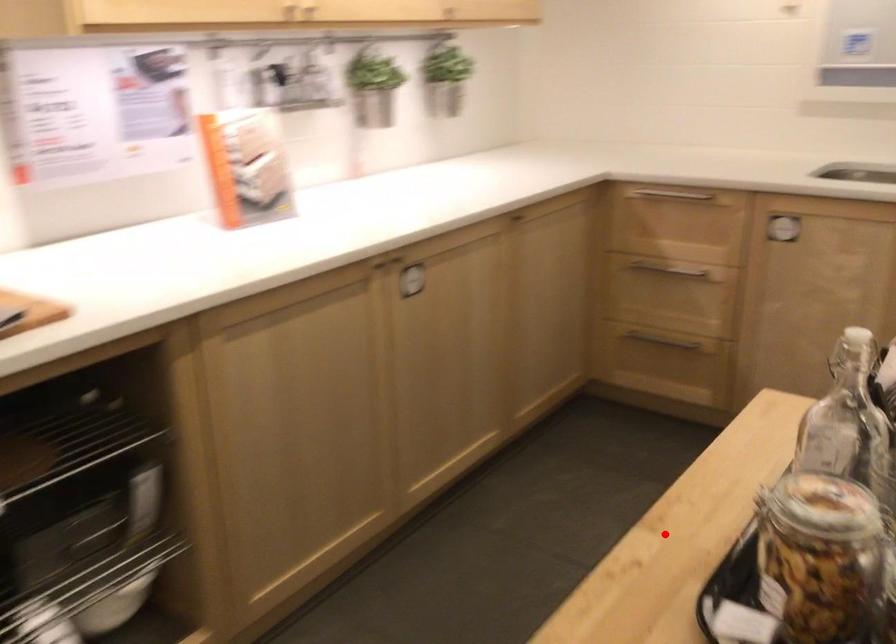
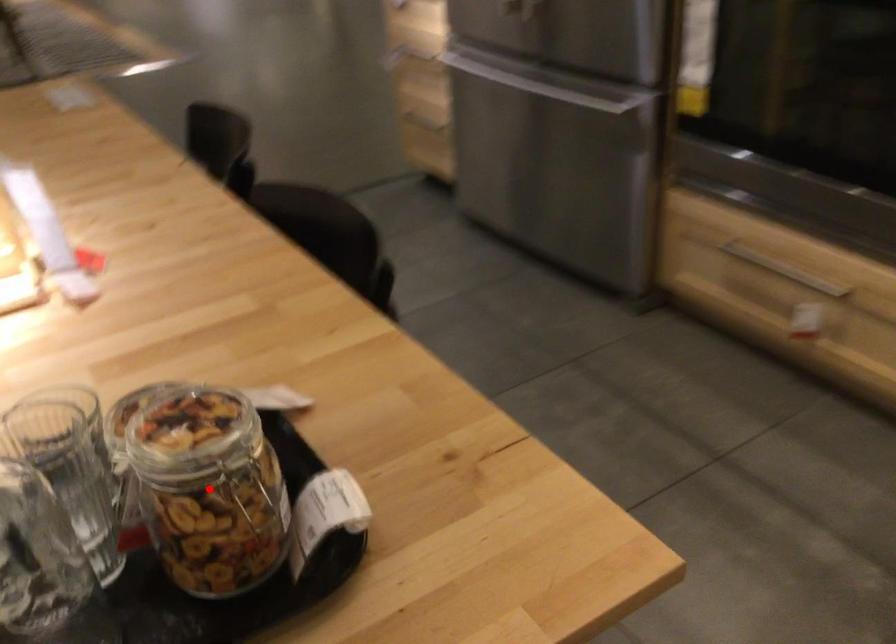
I am providing you with two images of the same scene from different viewpoints. A red point is marked on the first image and another point is marked on the second image. Are the points marked in image1 and image2 representing the same 3D position?

Yes